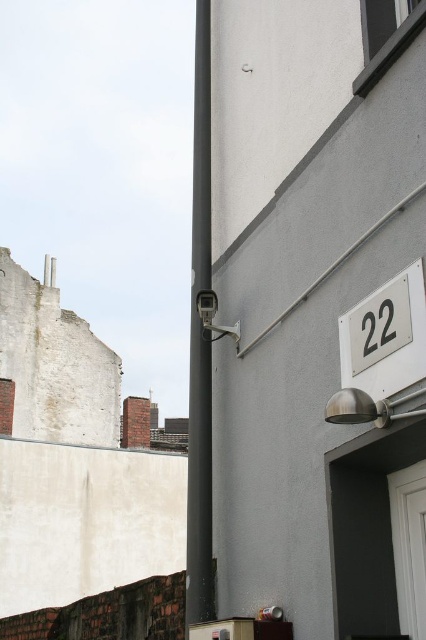
Who is higher up, black matte pole at center or white plastic number at upper right?

black matte pole at center is higher up.

This screenshot has width=426, height=640. Identify the location of black matte pole at center. (199, 346).

Can you confirm if black matte pole at center is wider than white glossy number plate at right?

Yes, black matte pole at center is wider than white glossy number plate at right.

Does black matte pole at center have a larger size compared to white glossy number plate at right?

Yes, black matte pole at center is bigger than white glossy number plate at right.

This screenshot has height=640, width=426. Describe the element at coordinates (199, 346) in the screenshot. I see `black matte pole at center` at that location.

The image size is (426, 640). I want to click on black matte pole at center, so click(199, 346).

Looking at this image, which of these two, white glossy number plate at right or white plastic number at upper right, stands taller?

With more height is white glossy number plate at right.

Does white glossy number plate at right come behind white plastic number at upper right?

No.

Where is `white glossy number plate at right`? The height and width of the screenshot is (640, 426). white glossy number plate at right is located at coordinates (385, 337).